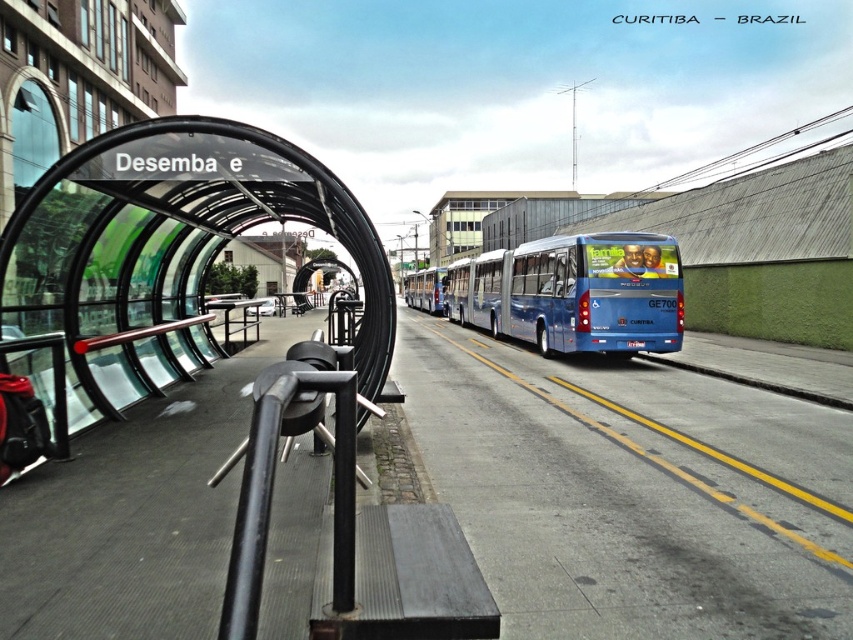
Does point (619, 260) come closer to viewer compared to point (811, 401)?

No, (619, 260) is further to viewer.

Can you confirm if blue metallic bus at center is positioned to the right of gray concrete curb at lower right?

Incorrect, blue metallic bus at center is not on the right side of gray concrete curb at lower right.

Find the location of a particular element. This screenshot has width=853, height=640. blue metallic bus at center is located at coordinates (573, 292).

Find the location of a particular element. This screenshot has width=853, height=640. blue metallic bus at center is located at coordinates (573, 292).